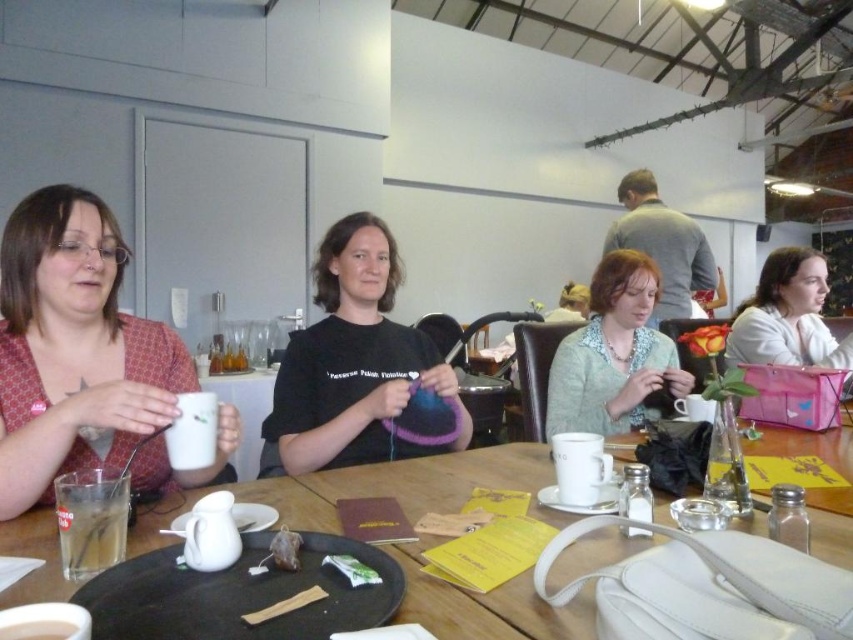
Question: Is translucent glass cup at lower left to the right of brown paper bag at center from the viewer's perspective?

Choices:
 (A) no
 (B) yes

Answer: (A)

Question: Does pink fabric purse at right appear on the left side of translucent glass cup at lower left?

Choices:
 (A) yes
 (B) no

Answer: (B)

Question: Which point appears closest to the camera in this image?

Choices:
 (A) (279, 369)
 (B) (74, 570)

Answer: (B)

Question: Which point is farther from the camera taking this photo?

Choices:
 (A) (57, 625)
 (B) (73, 531)
 (C) (795, 272)
 (D) (463, 412)

Answer: (C)

Question: Which of the following is the farthest from the observer?

Choices:
 (A) white ceramic mug at center
 (B) wooden table at center
 (C) white ceramic mug at lower left
 (D) black matte t-shirt at center

Answer: (A)

Question: Is translucent glass cup at lower left above white ceramic mug at center?

Choices:
 (A) no
 (B) yes

Answer: (B)